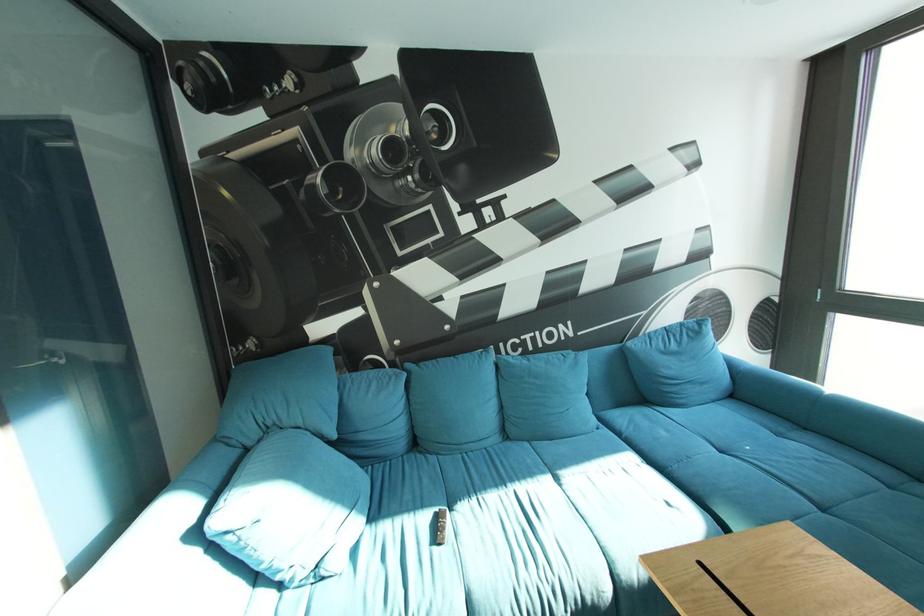
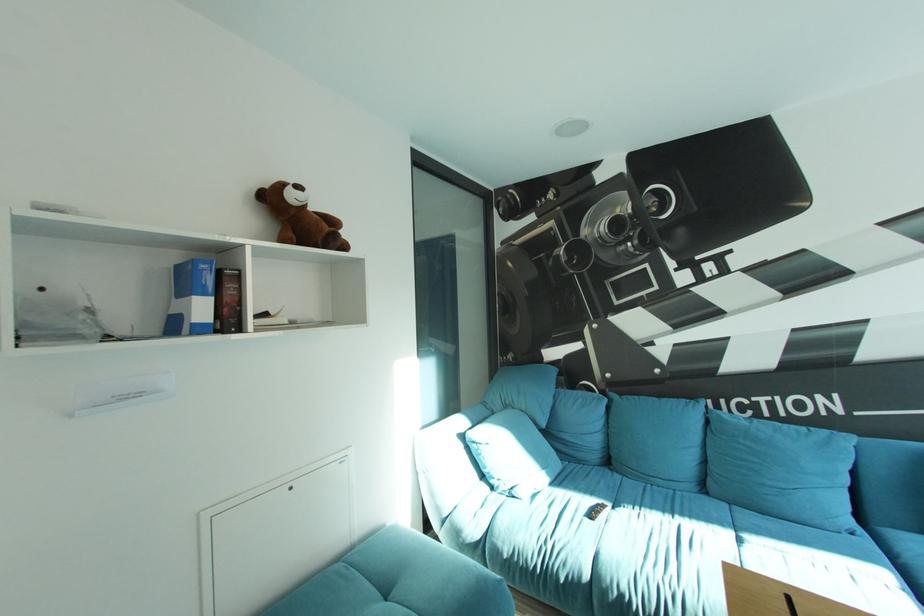
Question: The camera is either moving clockwise (left) or counter-clockwise (right) around the object. The first image is from the beginning of the video and the second image is from the end. Is the camera moving left or right when shooting the video?

Choices:
 (A) Left
 (B) Right

Answer: (B)